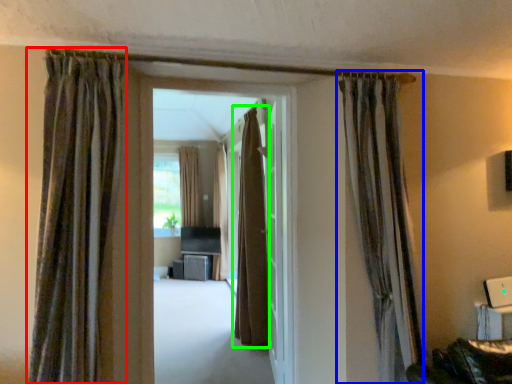
Question: Which is nearer to the curtain (highlighted by a red box)? curtain (highlighted by a blue box) or curtain (highlighted by a green box).

Choices:
 (A) curtain
 (B) curtain

Answer: (A)